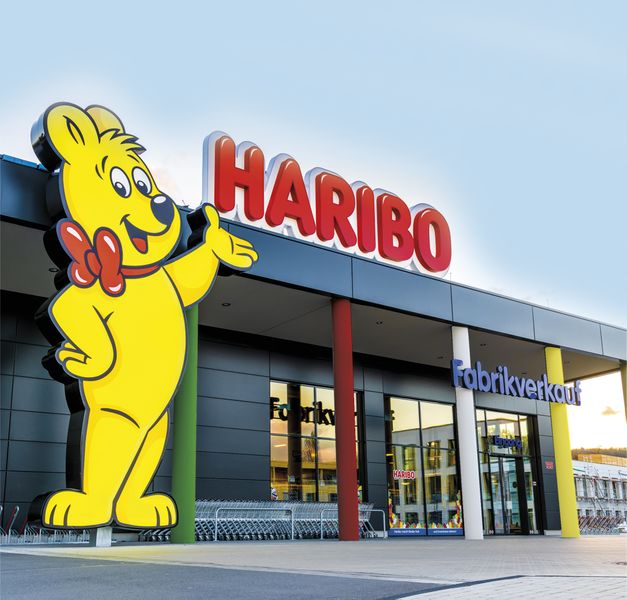
The height and width of the screenshot is (600, 627). Find the location of `window`. window is located at coordinates (409, 466).